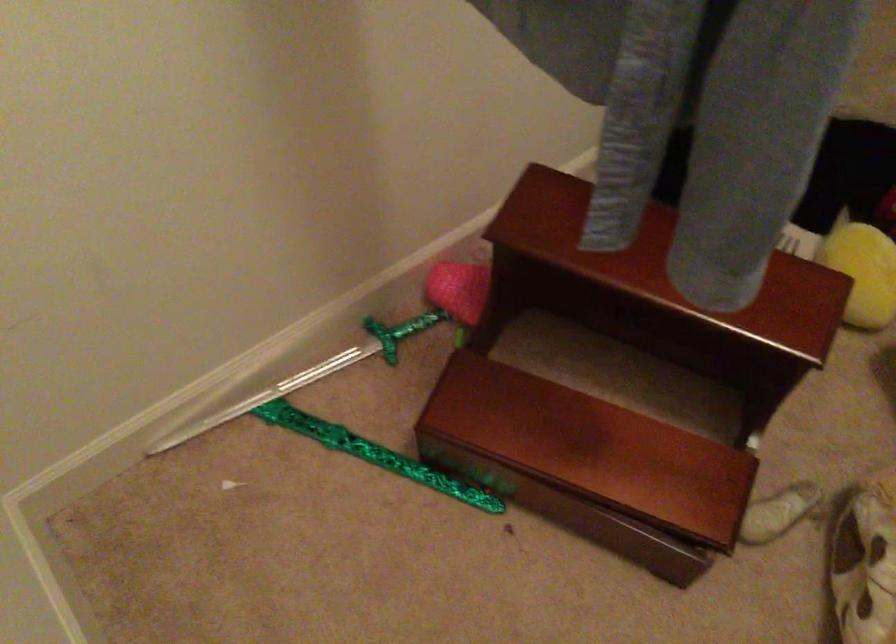
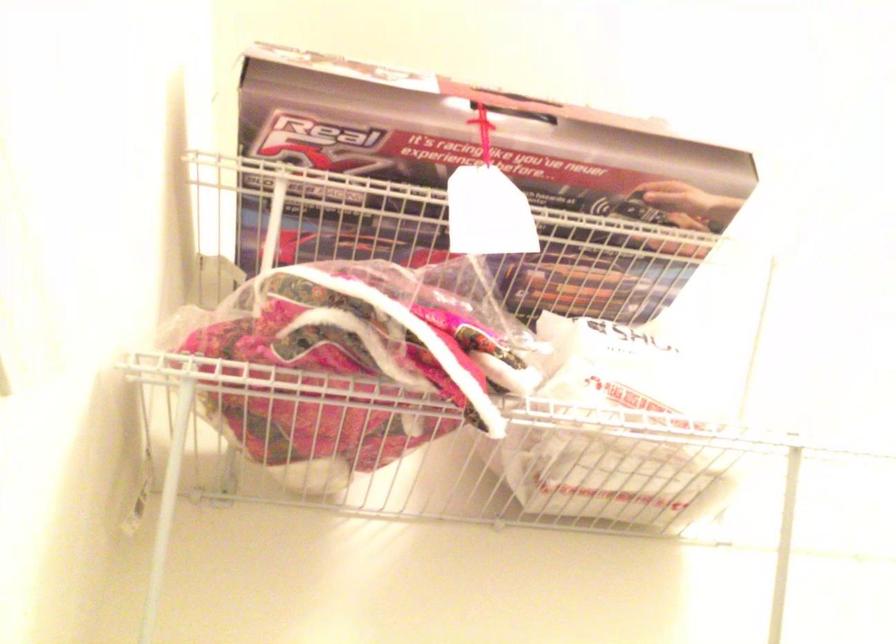
The images are taken continuously from a first-person perspective. In which direction is your viewpoint rotating?

The camera's rotation is toward left-up.